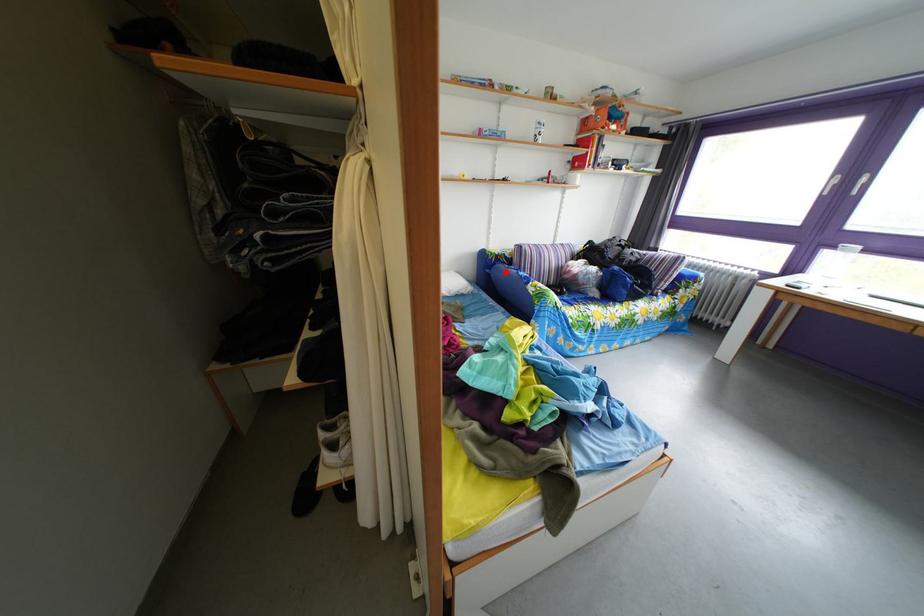
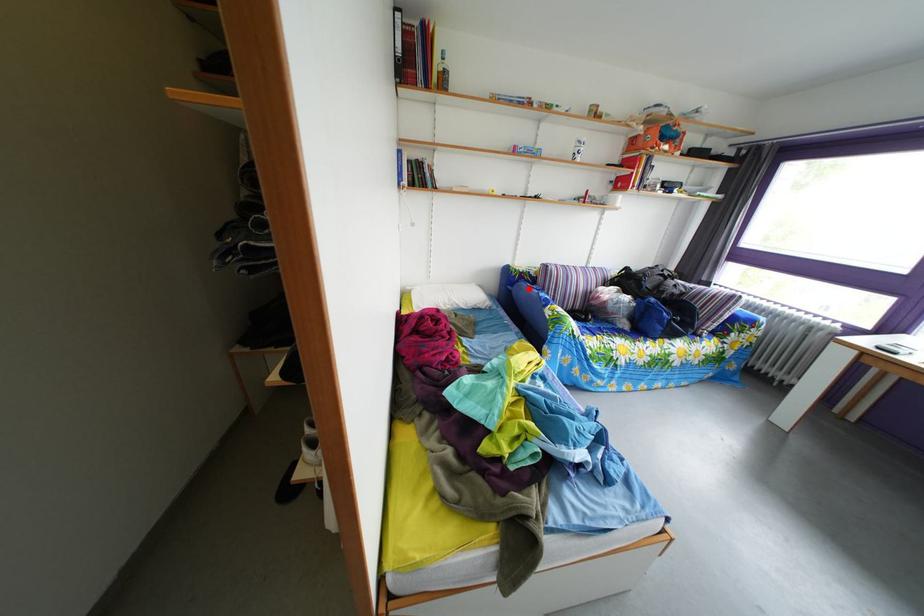
I am providing you with two images of the same scene from different viewpoints. A red point is marked on the first image and another point is marked on the second image. Does the point marked in image1 correspond to the same location as the one in image2?

Yes